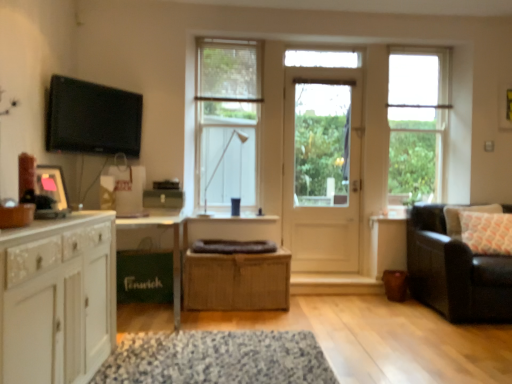
Locate an element on the screen. empty space that is ontop of speckled fabric mat at center (from a real-world perspective) is located at coordinates (226, 352).